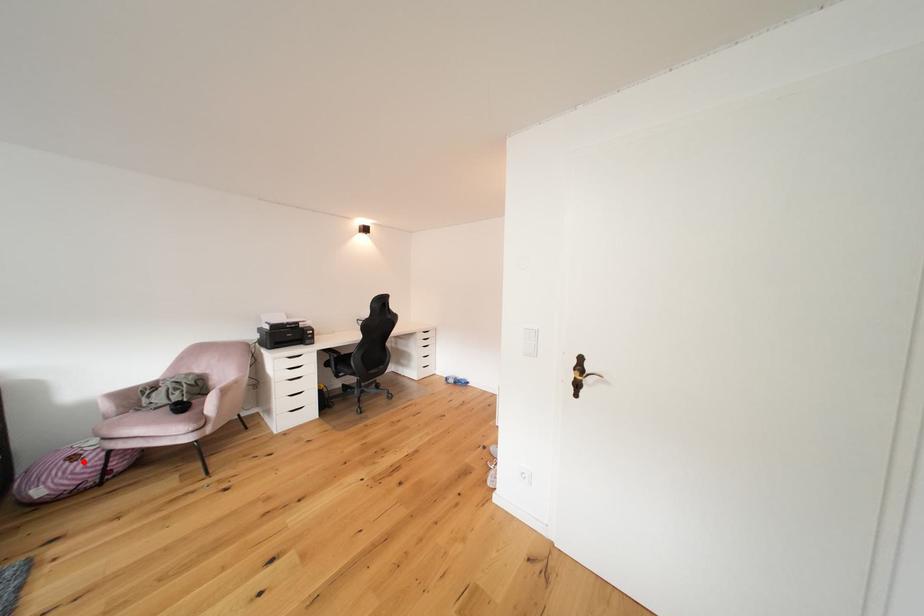
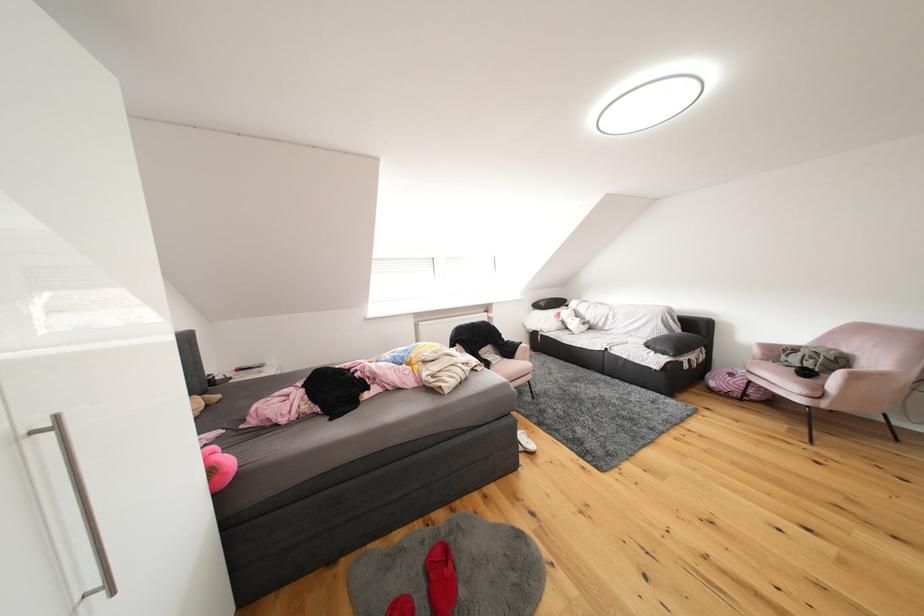
The point at the highlighted location is marked in the first image. Where is the corresponding point in the second image?

(740, 379)